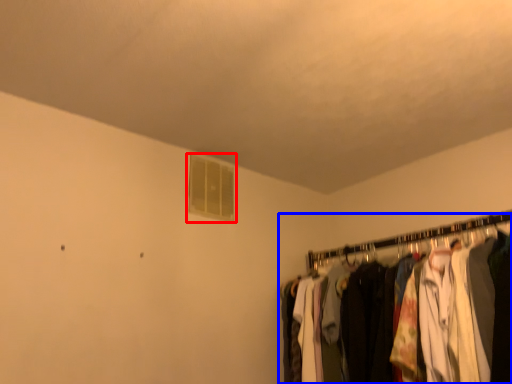
Question: Among these objects, which one is farthest to the camera, window (highlighted by a red box) or closet (highlighted by a blue box)?

Choices:
 (A) window
 (B) closet

Answer: (A)